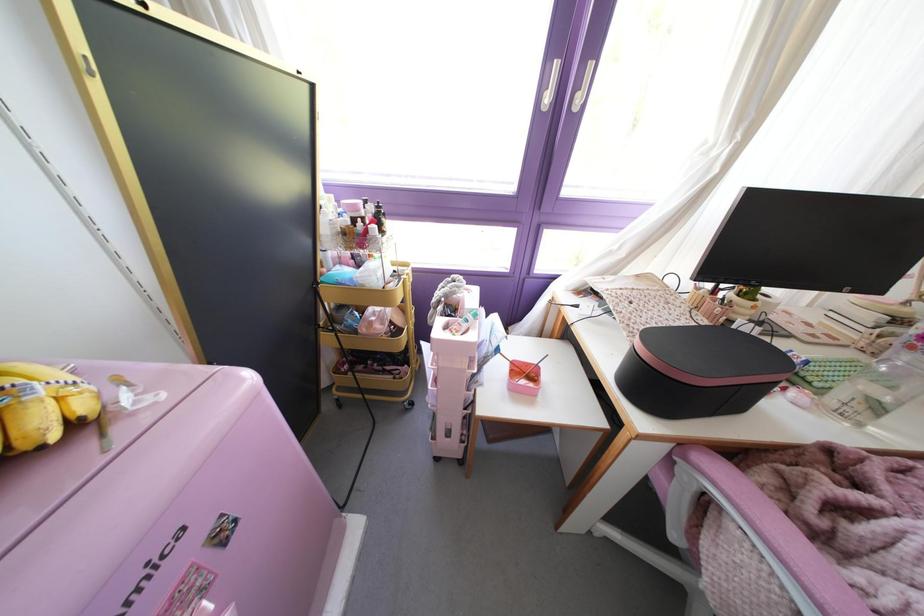
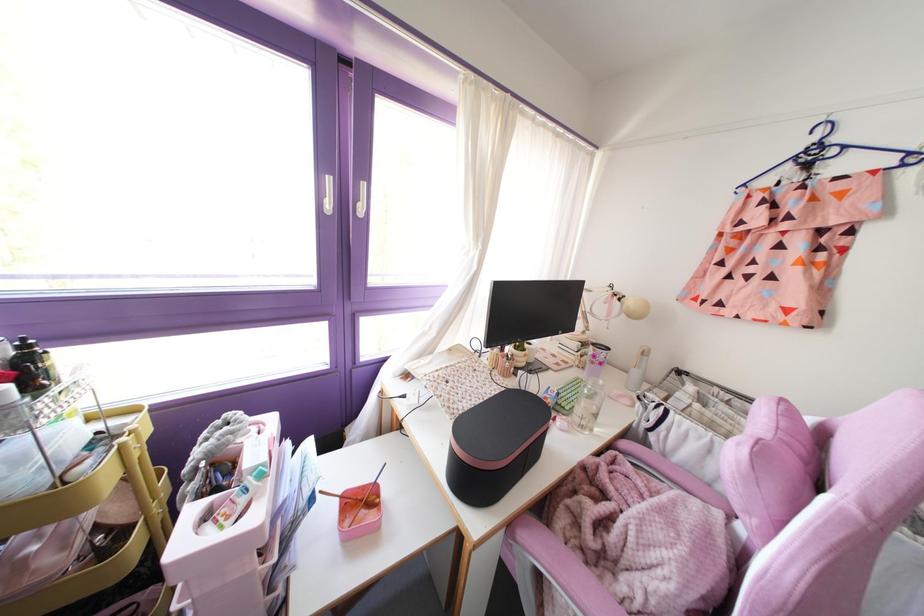
Where in the second image is the point corresponding to [532,363] from the first image?

(370, 484)